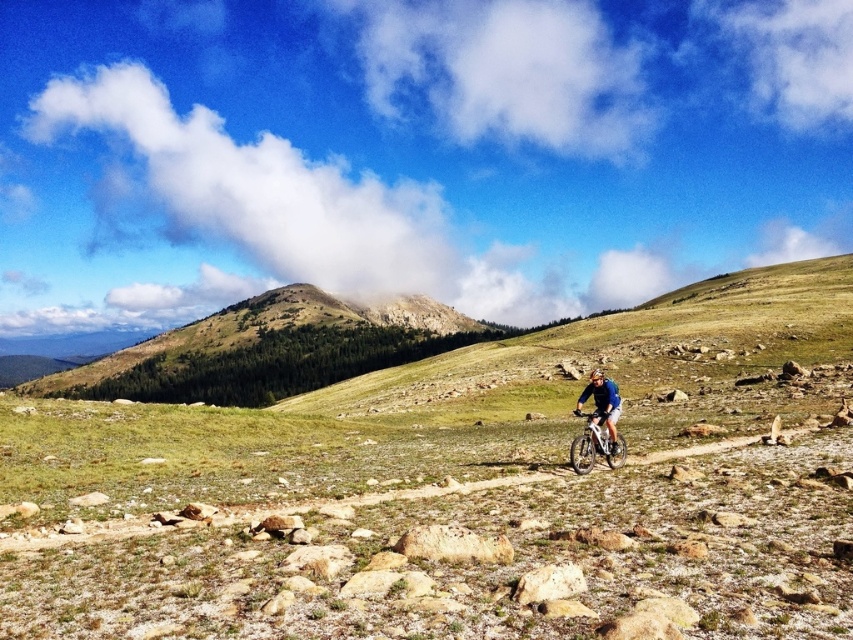
Question: Can you confirm if green forested mountain at upper center is positioned above blue matte shirt at center?

Choices:
 (A) yes
 (B) no

Answer: (A)

Question: From the image, what is the correct spatial relationship of green forested mountain at upper center in relation to blue matte shirt at center?

Choices:
 (A) below
 (B) above

Answer: (B)

Question: Which object is closer to the camera taking this photo?

Choices:
 (A) green forested mountain at upper center
 (B) blue matte shirt at center

Answer: (B)

Question: Is green forested mountain at upper center smaller than blue matte shirt at center?

Choices:
 (A) no
 (B) yes

Answer: (A)

Question: Which object appears closest to the camera in this image?

Choices:
 (A) blue matte shirt at center
 (B) green forested mountain at upper center

Answer: (A)